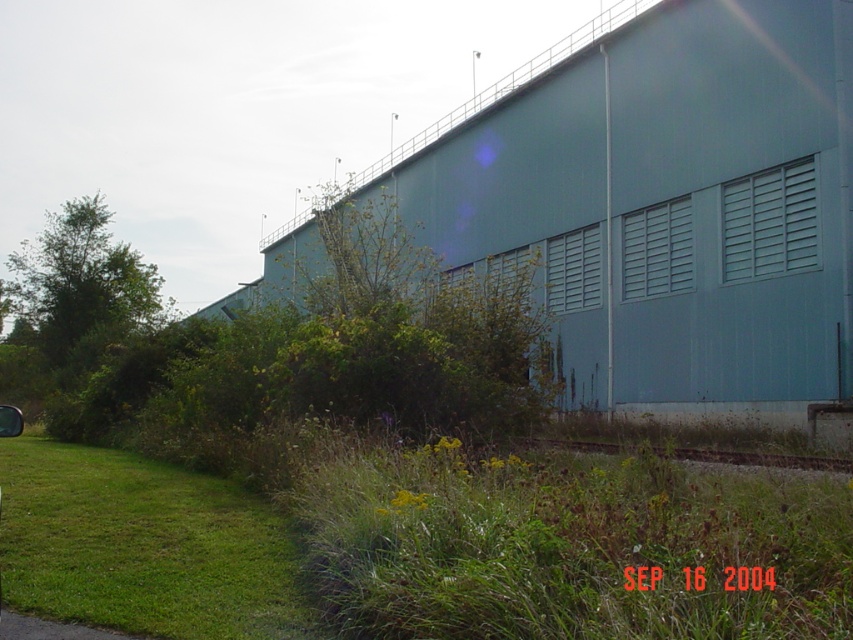
Question: Estimate the real-world distances between objects in this image. Which object is closer to the metallic silver car at lower left?

Choices:
 (A) gray gravel train track at lower center
 (B) green grassy at lower left

Answer: (B)

Question: Can you confirm if green grassy at lower left is bigger than gray gravel train track at lower center?

Choices:
 (A) no
 (B) yes

Answer: (A)

Question: Considering the real-world distances, which object is closest to the green grassy at lower left?

Choices:
 (A) gray gravel train track at lower center
 (B) metallic silver car at lower left

Answer: (B)

Question: From the image, what is the correct spatial relationship of green grassy at lower left in relation to gray gravel train track at lower center?

Choices:
 (A) right
 (B) left

Answer: (B)

Question: Which object is the closest to the green grassy at lower left?

Choices:
 (A) gray gravel train track at lower center
 (B) metallic silver car at lower left

Answer: (B)

Question: Where is green grassy at lower left located in relation to gray gravel train track at lower center in the image?

Choices:
 (A) right
 (B) left

Answer: (B)